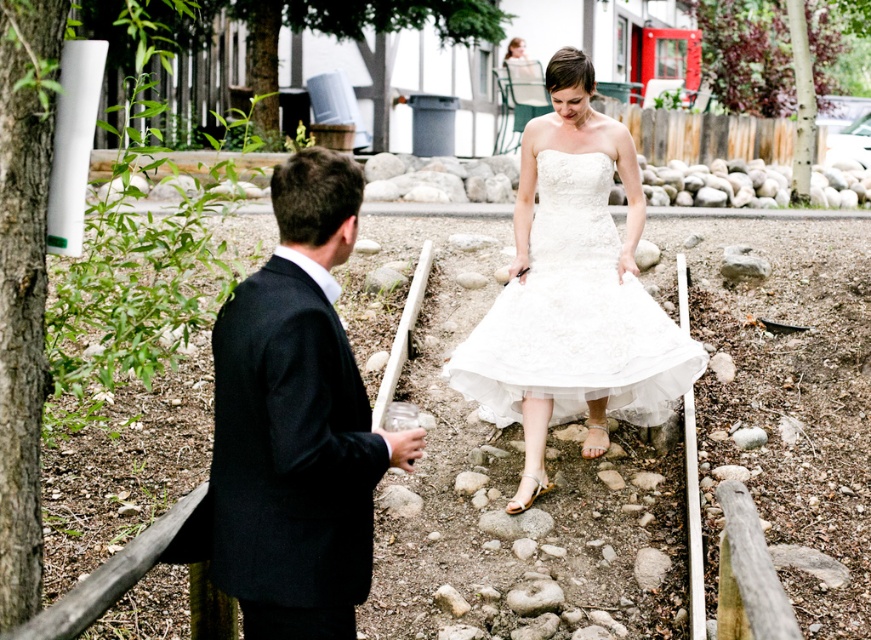
Who is lower down, black wool suit at left or white satin dress at center?

black wool suit at left is below.

Who is more distant from viewer, (307, 323) or (596, 426)?

The point (596, 426) is behind.

Describe the element at coordinates (296, 422) in the screenshot. I see `black wool suit at left` at that location.

Locate an element on the screen. black wool suit at left is located at coordinates point(296,422).

Is white satin dress at center to the right of white lace dress at center from the viewer's perspective?

Incorrect, white satin dress at center is not on the right side of white lace dress at center.

Is point (643, 298) positioned after point (632, 289)?

No, (643, 298) is closer to viewer.

Identify the location of white satin dress at center. (579, 301).

What do you see at coordinates (296, 422) in the screenshot?
I see `black wool suit at left` at bounding box center [296, 422].

Can you confirm if black wool suit at left is bigger than white lace dress at center?

Incorrect, black wool suit at left is not larger than white lace dress at center.

Identify the location of black wool suit at left. (296, 422).